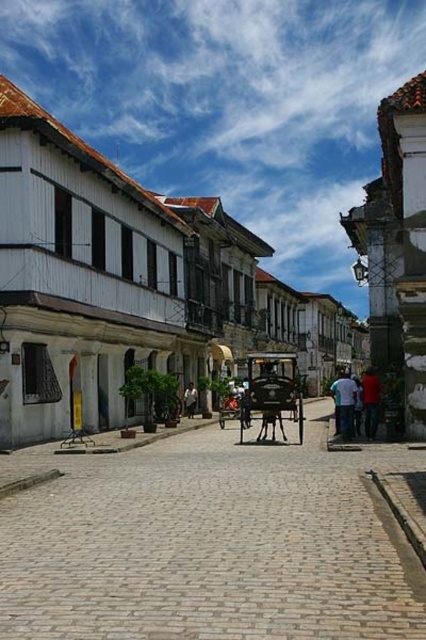
Is red shirt at center shorter than white cotton shirt at right?

Incorrect, red shirt at center's height does not fall short of white cotton shirt at right's.

Does red shirt at center have a lesser width compared to white cotton shirt at right?

Yes, red shirt at center is thinner than white cotton shirt at right.

In order to click on red shirt at center in this screenshot , I will do 351,400.

Where is `red shirt at center`? This screenshot has width=426, height=640. red shirt at center is located at coordinates (351, 400).

Who is lower down, shiny black cart at center or red shirt at center?

red shirt at center

Does shiny black cart at center have a lesser width compared to red shirt at center?

Correct, shiny black cart at center's width is less than red shirt at center's.

The height and width of the screenshot is (640, 426). Describe the element at coordinates (271, 394) in the screenshot. I see `shiny black cart at center` at that location.

Identify the location of shiny black cart at center. (271, 394).

Who is higher up, red shirt at center or dark red fabric at right?

red shirt at center

Does red shirt at center have a lesser width compared to dark red fabric at right?

Indeed, red shirt at center has a lesser width compared to dark red fabric at right.

The image size is (426, 640). In order to click on red shirt at center in this screenshot , I will do `click(351, 400)`.